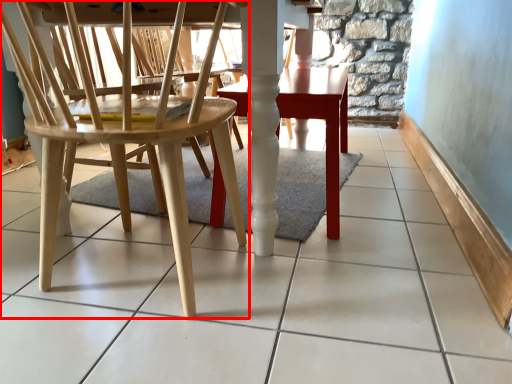
Question: Considering the relative positions of chair (annotated by the red box) and table in the image provided, where is chair (annotated by the red box) located with respect to the staircase?

Choices:
 (A) left
 (B) right

Answer: (A)